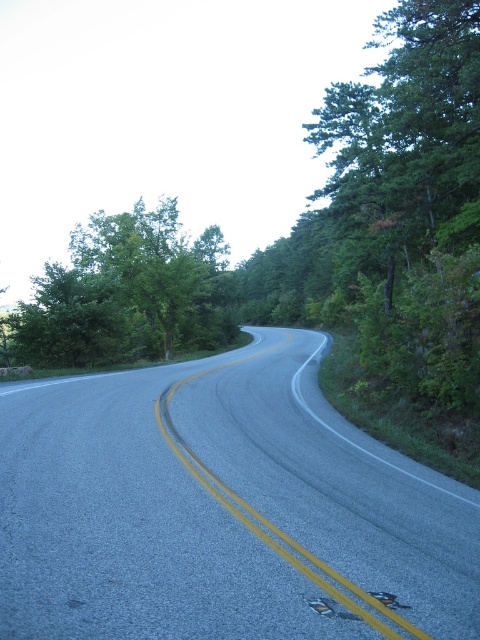
You are driving a car and see the gray asphalt road at center and the green leafy tree at left. Which object is nearer to you?

The gray asphalt road at center is closer to the viewer than the green leafy tree at left.

Based on the photo, you are a driver approaching the gray asphalt road at center. To your left, there is a green leafy tree at left. Based on the scene, which object is taller?

The green leafy tree at left is taller than the gray asphalt road at center.

You are standing at the point marked as point (223,508). Looking around, you see the gray asphalt road at center. Which direction should you walk to stay on the gray asphalt road at center?

The gray asphalt road at center is located at point (223,508), so you should walk along the direction of the road to stay on it.